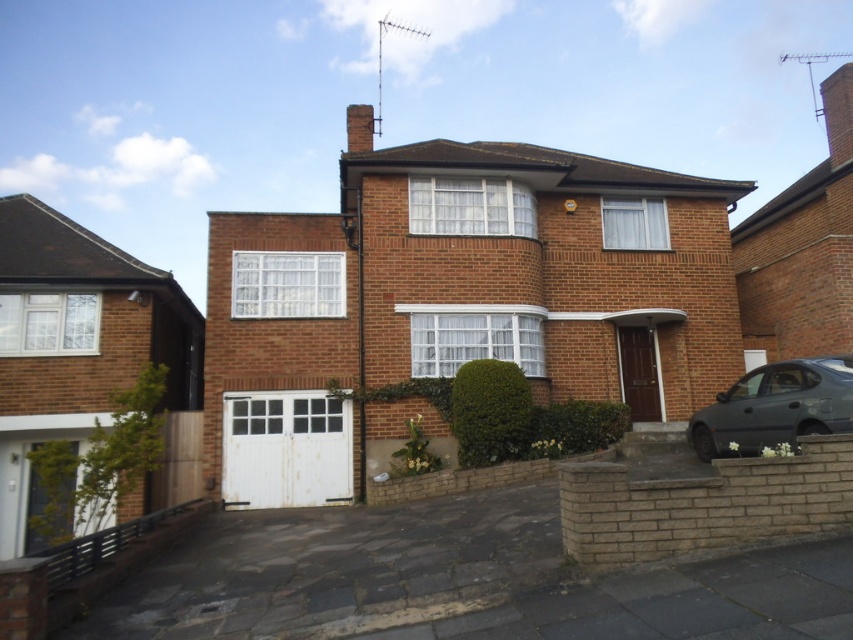
You are a delivery person with a 1.5 meter wide delivery cart. You need to park your cart between the white painted wood garage door at lower center and the dark gray metallic car at lower right. Is there enough space for your cart to fit between them?

The distance between the white painted wood garage door at lower center and the dark gray metallic car at lower right is 7.03 meters. Since your cart is only 1.5 meters wide, there is sufficient space to park it between them.

You are standing at the entrance of the white painted wood garage door at lower center. You want to walk to the front door of the house, which is not visible in the image. The front door is located on the opposite side of the garage door. If the distance between the garage door and the front door is 40.72 feet, how many steps would it take to reach the front door if each step is approximately 2.5 feet?

The distance between the white painted wood garage door at lower center and the front door is 40.72 feet. Each step is 2.5 feet, so dividing 40.72 by 2.5 gives approximately 16.29 steps. Since you can only take whole steps, it would take about 16 steps to reach the front door.